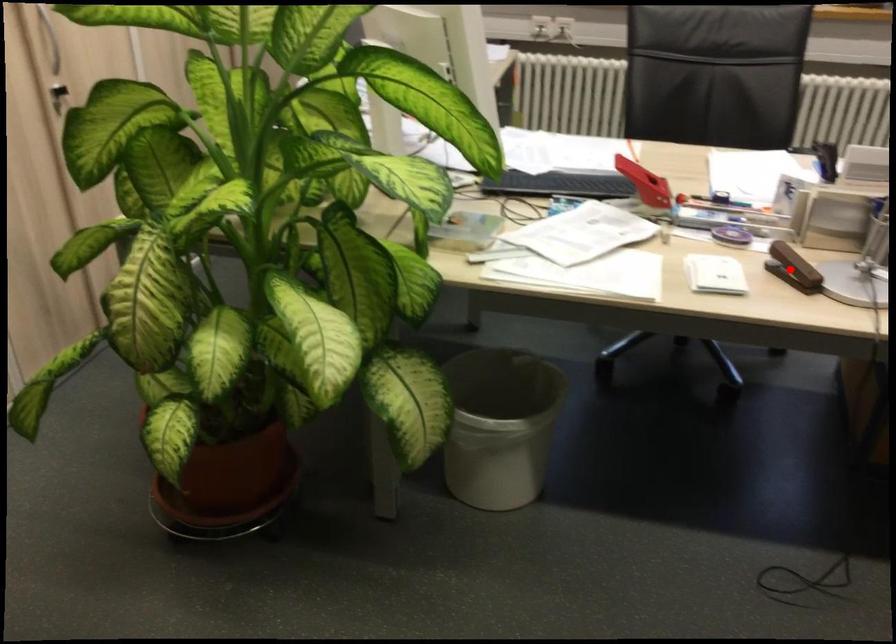
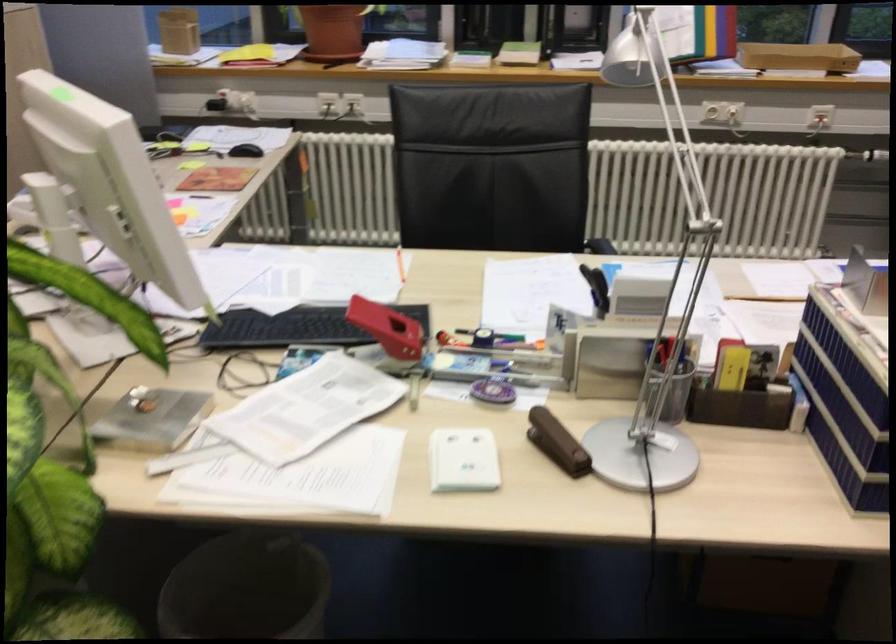
In the second image, find the point that corresponds to the highlighted location in the first image.

(556, 442)